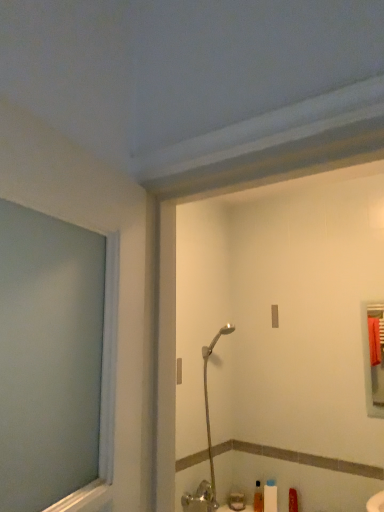
Question: From the image's perspective, does translucent plastic soap dispenser at lower center appear lower than white matte toilet paper at lower center?

Choices:
 (A) yes
 (B) no

Answer: (A)

Question: Does translucent plastic soap dispenser at lower center have a lesser height compared to white matte toilet paper at lower center?

Choices:
 (A) yes
 (B) no

Answer: (A)

Question: Considering the relative sizes of translucent plastic soap dispenser at lower center and white matte toilet paper at lower center in the image provided, is translucent plastic soap dispenser at lower center bigger than white matte toilet paper at lower center?

Choices:
 (A) yes
 (B) no

Answer: (B)

Question: Is translucent plastic soap dispenser at lower center facing away from white matte toilet paper at lower center?

Choices:
 (A) no
 (B) yes

Answer: (A)

Question: From a real-world perspective, does translucent plastic soap dispenser at lower center sit lower than white matte toilet paper at lower center?

Choices:
 (A) no
 (B) yes

Answer: (B)

Question: Does translucent plastic soap dispenser at lower center have a greater width compared to white matte toilet paper at lower center?

Choices:
 (A) no
 (B) yes

Answer: (A)

Question: Does white matte toilet paper at lower center lie in front of silver metallic shower head at center?

Choices:
 (A) no
 (B) yes

Answer: (A)

Question: Considering the relative positions of white matte toilet paper at lower center and silver metallic shower head at center in the image provided, is white matte toilet paper at lower center to the right of silver metallic shower head at center from the viewer's perspective?

Choices:
 (A) yes
 (B) no

Answer: (A)

Question: Is the position of white matte toilet paper at lower center more distant than that of silver metallic shower head at center?

Choices:
 (A) yes
 (B) no

Answer: (A)

Question: From a real-world perspective, is white matte toilet paper at lower center below silver metallic shower head at center?

Choices:
 (A) yes
 (B) no

Answer: (A)

Question: Considering the relative sizes of white matte toilet paper at lower center and silver metallic shower head at center in the image provided, is white matte toilet paper at lower center thinner than silver metallic shower head at center?

Choices:
 (A) no
 (B) yes

Answer: (B)

Question: From a real-world perspective, does white matte toilet paper at lower center stand above silver metallic shower head at center?

Choices:
 (A) yes
 (B) no

Answer: (B)

Question: Considering the relative sizes of translucent plastic soap dispenser at lower center and silver metallic shower head at center in the image provided, is translucent plastic soap dispenser at lower center shorter than silver metallic shower head at center?

Choices:
 (A) yes
 (B) no

Answer: (A)